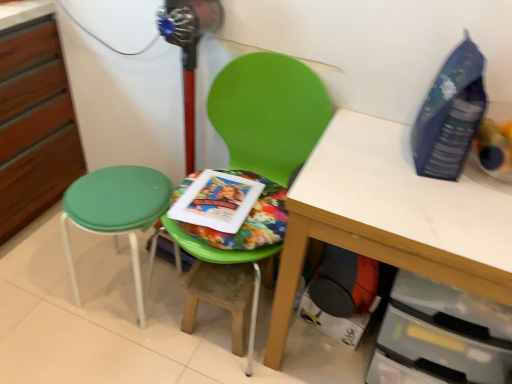
I want to click on vacant space that is to the left of green fabric stool at left, so click(51, 281).